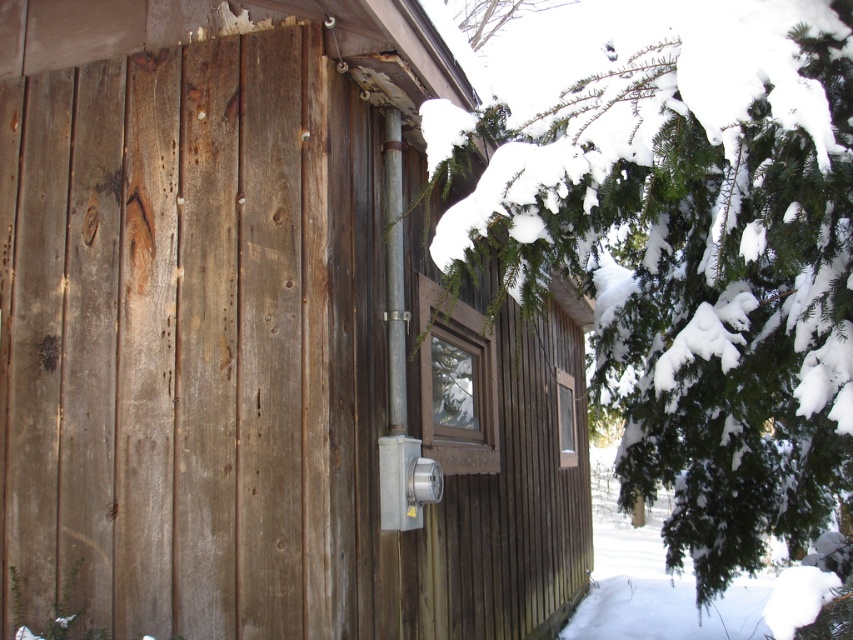
Question: Which point is closer to the camera?

Choices:
 (A) weathered wood cabin at center
 (B) green textured pine tree at upper right

Answer: (A)

Question: Does weathered wood cabin at center have a larger size compared to green textured pine tree at upper right?

Choices:
 (A) yes
 (B) no

Answer: (A)

Question: Is weathered wood cabin at center to the left of green textured pine tree at upper right from the viewer's perspective?

Choices:
 (A) no
 (B) yes

Answer: (B)

Question: Among these objects, which one is farthest from the camera?

Choices:
 (A) green textured pine tree at upper right
 (B) weathered wood cabin at center

Answer: (A)

Question: Which point is farther to the camera?

Choices:
 (A) green textured pine tree at upper right
 (B) weathered wood cabin at center

Answer: (A)

Question: Does weathered wood cabin at center appear over green textured pine tree at upper right?

Choices:
 (A) no
 (B) yes

Answer: (B)